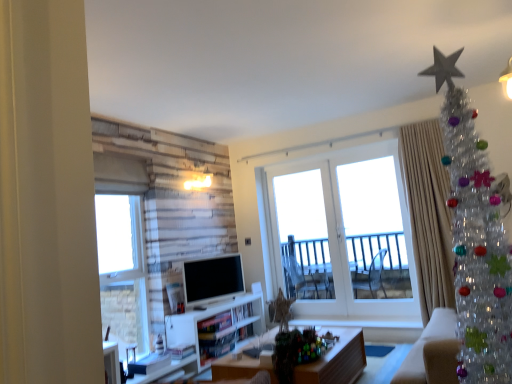
In order to click on blank space situated above clear glass window at left, the second window viewed from the back (from a real-world perspective) in this screenshot , I will do `click(110, 195)`.